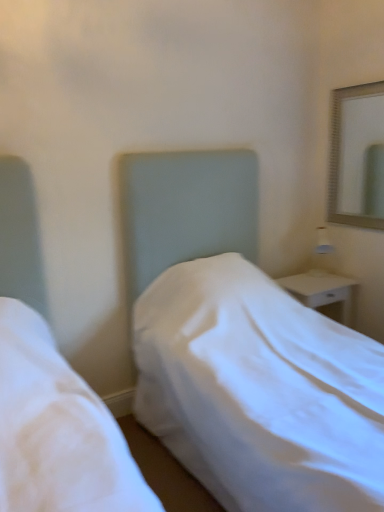
Where is `vacant space situated above white glossy nightstand at right (from a real-world perspective)`? The width and height of the screenshot is (384, 512). vacant space situated above white glossy nightstand at right (from a real-world perspective) is located at coordinates (327, 278).